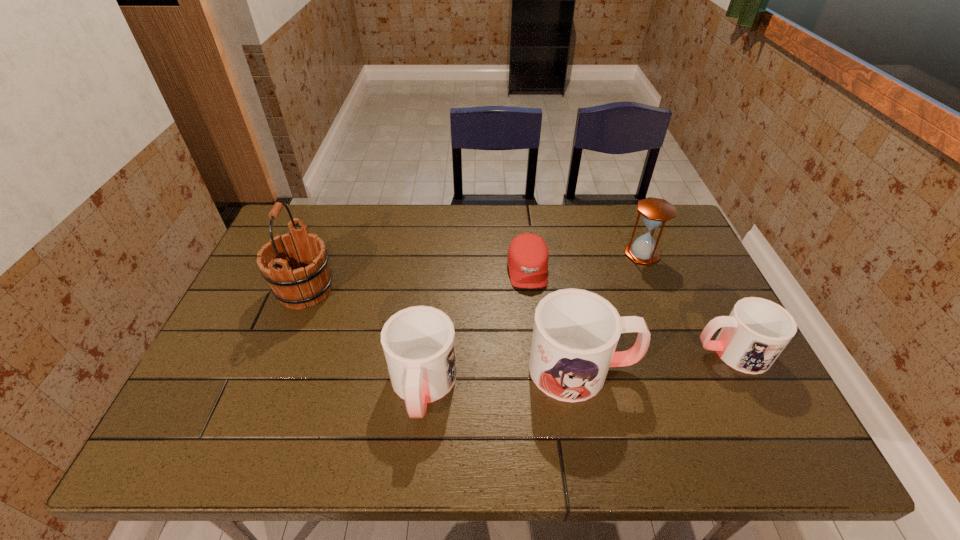
Find the location of a particular element. the second shortest mug is located at coordinates (418, 342).

Identify the location of the fifth object from right to left. (418, 342).

Identify the location of the second mug from right to left. The image size is (960, 540). (575, 334).

Identify the location of the shortest mug. The image size is (960, 540). (757, 330).

Locate an element on the screen. This screenshot has height=540, width=960. the fifth tallest object is located at coordinates (757, 330).

Where is `hourglass`? The width and height of the screenshot is (960, 540). hourglass is located at coordinates pyautogui.click(x=655, y=212).

Identify the location of cap. (528, 255).

This screenshot has width=960, height=540. Identify the location of wine bucket. pos(310,282).

What are the coordinates of `the leftmost object` in the screenshot? It's located at (310, 282).

Identify the location of vacant area situated 0.210m on the side of the second mug from left to right with the handle. (722, 368).